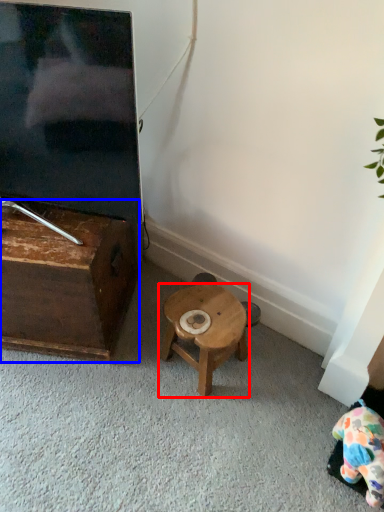
Question: Among these objects, which one is farthest to the camera, stool (highlighted by a red box) or table (highlighted by a blue box)?

Choices:
 (A) stool
 (B) table

Answer: (A)